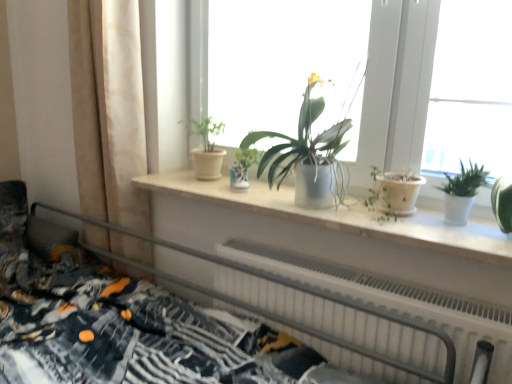
Question: Is patterned fabric bed at lower left spatially inside white glossy pot at right, which is the 1th houseplant in right-to-left order, or outside of it?

Choices:
 (A) inside
 (B) outside

Answer: (B)

Question: From the image's perspective, is patterned fabric bed at lower left located above or below white glossy pot at right, which is the 1th houseplant in right-to-left order?

Choices:
 (A) below
 (B) above

Answer: (A)

Question: Estimate the real-world distances between objects in this image. Which object is closer to the matte white pot at center, marked as the 3th houseplant in a right-to-left arrangement?

Choices:
 (A) patterned fabric bed at lower left
 (B) white plastic radiator at lower center
 (C) white glossy pot at right, which is the 3th houseplant in left-to-right order
 (D) matte silver pot at center, the second houseplant viewed from the left
 (E) matte white windowsill at center

Answer: (D)

Question: Considering the real-world distances, which object is closest to the white matte window sill at center?

Choices:
 (A) white plastic radiator at lower center
 (B) matte white windowsill at center
 (C) patterned fabric bed at lower left
 (D) matte white pot at center, marked as the 3th houseplant in a right-to-left arrangement
 (E) beige fabric curtain at left

Answer: (A)